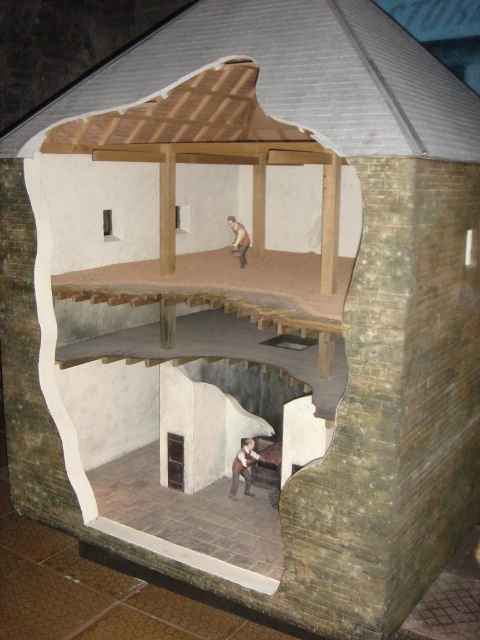
Question: Is brown leather jacket at lower center smaller than dark gray stone hole at lower center?

Choices:
 (A) yes
 (B) no

Answer: (B)

Question: Which object appears closest to the camera in this image?

Choices:
 (A) brown leather jacket at lower center
 (B) dark gray stone hole at lower center

Answer: (A)

Question: Can you confirm if dark gray stone hole at lower center is positioned below smooth beige shirt at upper center?

Choices:
 (A) yes
 (B) no

Answer: (A)

Question: Estimate the real-world distances between objects in this image. Which object is closer to the brown leather jacket at lower center?

Choices:
 (A) smooth beige shirt at upper center
 (B) dark gray stone hole at lower center

Answer: (B)

Question: Can you confirm if brown leather jacket at lower center is positioned to the left of dark gray stone hole at lower center?

Choices:
 (A) yes
 (B) no

Answer: (B)

Question: Which point appears farthest from the camera in this image?

Choices:
 (A) (254, 454)
 (B) (167, 442)

Answer: (B)